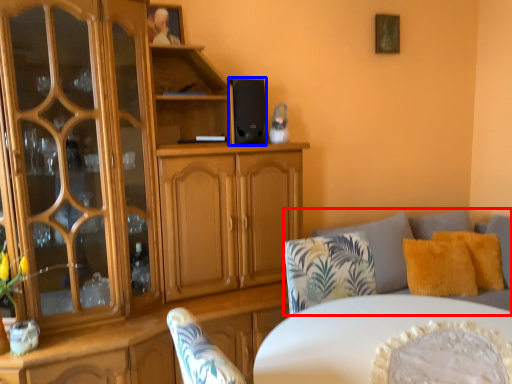
Question: Among these objects, which one is nearest to the camera, studio couch (highlighted by a red box) or speaker (highlighted by a blue box)?

Choices:
 (A) studio couch
 (B) speaker

Answer: (A)